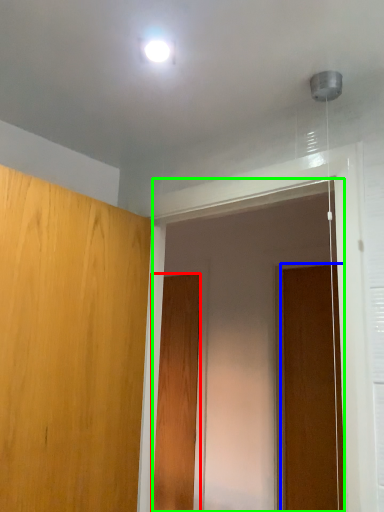
Question: Estimate the real-world distances between objects in this image. Which object is farther from door (highlighted by a red box), door (highlighted by a blue box) or screen door (highlighted by a green box)?

Choices:
 (A) door
 (B) screen door

Answer: (A)